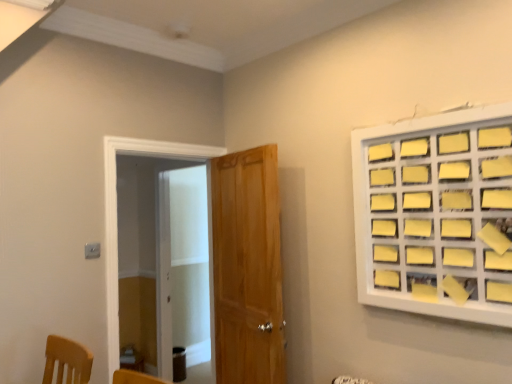
Question: Can wooden door at center be found inside yellow paper at upper right?

Choices:
 (A) no
 (B) yes

Answer: (A)

Question: Is yellow paper at upper right not inside wooden door at center?

Choices:
 (A) no
 (B) yes

Answer: (B)

Question: Does yellow paper at upper right have a lesser width compared to wooden door at center?

Choices:
 (A) no
 (B) yes

Answer: (B)

Question: Considering the relative sizes of yellow paper at upper right and wooden door at center in the image provided, is yellow paper at upper right taller than wooden door at center?

Choices:
 (A) no
 (B) yes

Answer: (A)

Question: Is yellow paper at upper right at the left side of wooden door at center?

Choices:
 (A) no
 (B) yes

Answer: (A)

Question: Does yellow paper at upper right appear on the right side of wooden door at center?

Choices:
 (A) no
 (B) yes

Answer: (B)

Question: Is transparent glass screen door at left surrounded by yellow paper at upper right?

Choices:
 (A) no
 (B) yes

Answer: (A)

Question: From the image's perspective, would you say yellow paper at upper right is shown under transparent glass screen door at left?

Choices:
 (A) no
 (B) yes

Answer: (A)

Question: Considering the relative positions of yellow paper at upper right and transparent glass screen door at left in the image provided, is yellow paper at upper right to the right of transparent glass screen door at left from the viewer's perspective?

Choices:
 (A) no
 (B) yes

Answer: (B)

Question: Is yellow paper at upper right turned away from transparent glass screen door at left?

Choices:
 (A) yes
 (B) no

Answer: (B)

Question: Can you see yellow paper at upper right touching transparent glass screen door at left?

Choices:
 (A) no
 (B) yes

Answer: (A)

Question: Is the depth of yellow paper at upper right greater than that of transparent glass screen door at left?

Choices:
 (A) no
 (B) yes

Answer: (A)

Question: Is wooden door at center positioned beyond the bounds of yellow paper at upper right?

Choices:
 (A) yes
 (B) no

Answer: (A)